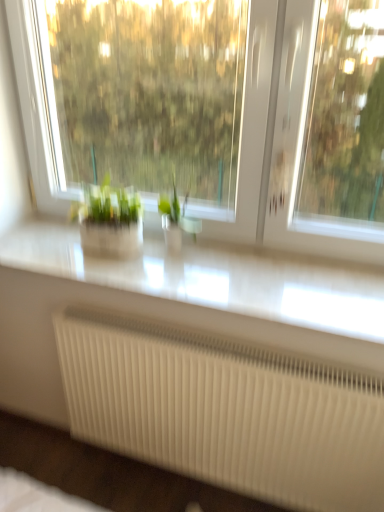
Question: Should I look upward or downward to see transparent glass window at center?

Choices:
 (A) up
 (B) down

Answer: (A)

Question: From the image's perspective, is white glossy counter top at center located beneath transparent glass window at center?

Choices:
 (A) no
 (B) yes

Answer: (B)

Question: Considering the relative sizes of white glossy counter top at center and transparent glass window at center in the image provided, is white glossy counter top at center shorter than transparent glass window at center?

Choices:
 (A) yes
 (B) no

Answer: (A)

Question: From a real-world perspective, is white glossy counter top at center on top of transparent glass window at center?

Choices:
 (A) yes
 (B) no

Answer: (B)

Question: Is white glossy counter top at center far away from transparent glass window at center?

Choices:
 (A) yes
 (B) no

Answer: (A)

Question: Is white glossy counter top at center smaller than transparent glass window at center?

Choices:
 (A) yes
 (B) no

Answer: (A)

Question: Considering the relative sizes of white glossy counter top at center and transparent glass window at center in the image provided, is white glossy counter top at center thinner than transparent glass window at center?

Choices:
 (A) no
 (B) yes

Answer: (A)

Question: Considering the relative sizes of transparent glass window at center and green matte plant at center in the image provided, is transparent glass window at center shorter than green matte plant at center?

Choices:
 (A) yes
 (B) no

Answer: (B)

Question: Does transparent glass window at center appear on the right side of green matte plant at center?

Choices:
 (A) yes
 (B) no

Answer: (A)

Question: Is transparent glass window at center completely or partially outside of green matte plant at center?

Choices:
 (A) no
 (B) yes

Answer: (B)

Question: Is transparent glass window at center not close to green matte plant at center?

Choices:
 (A) no
 (B) yes

Answer: (B)

Question: From the image's perspective, is transparent glass window at center below green matte plant at center?

Choices:
 (A) yes
 (B) no

Answer: (B)

Question: Can you confirm if transparent glass window at center is thinner than green matte plant at center?

Choices:
 (A) yes
 (B) no

Answer: (B)

Question: Is green matte plant at center inside white ribbed radiator at lower center?

Choices:
 (A) no
 (B) yes

Answer: (A)